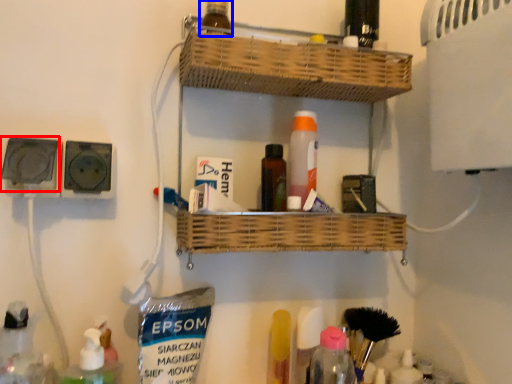
Question: Which object is closer to the camera taking this photo, electric outlet (highlighted by a red box) or bottle (highlighted by a blue box)?

Choices:
 (A) electric outlet
 (B) bottle

Answer: (A)